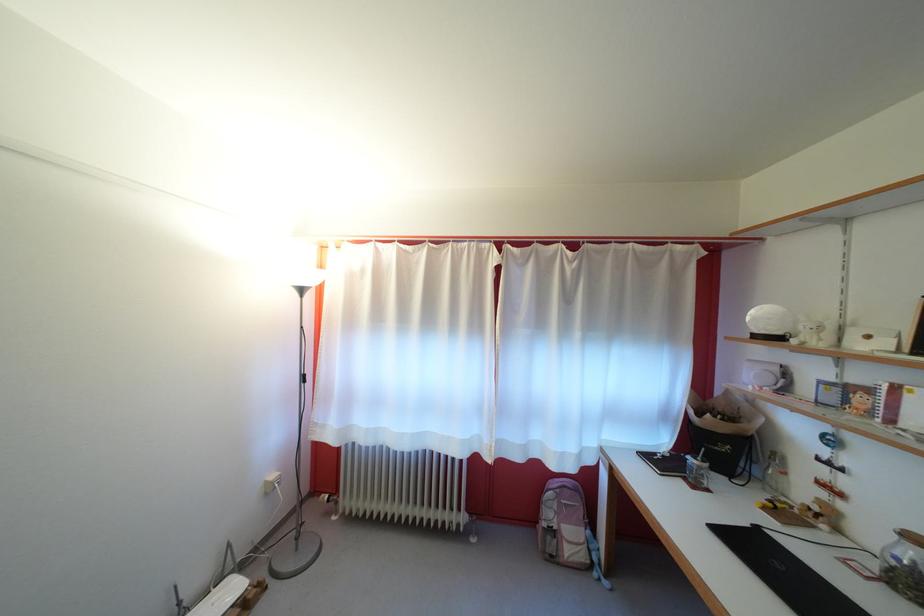
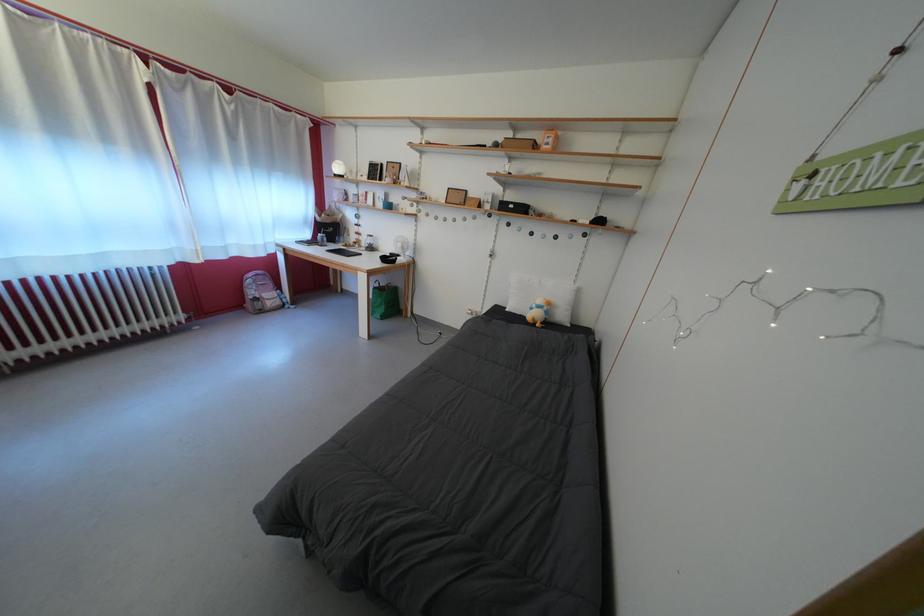
Where in the second image is the point corresponding to pixel 831 500 from the first image?

(365, 243)